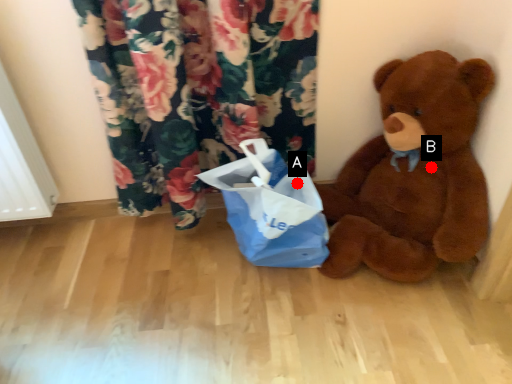
Question: Two points are circled on the image, labeled by A and B beside each circle. Which point is closer to the camera?

Choices:
 (A) A is closer
 (B) B is closer

Answer: (B)